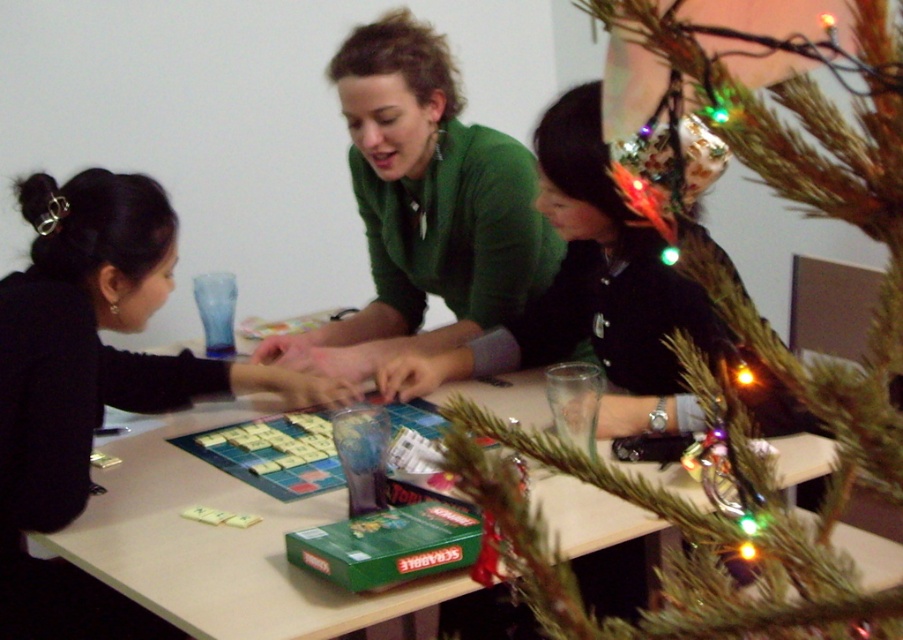
Which of these two, black matte shirt at center or matte plastic board game at center, stands taller?

With more height is black matte shirt at center.

The width and height of the screenshot is (903, 640). In order to click on black matte shirt at center in this screenshot , I will do `click(91, 385)`.

Image resolution: width=903 pixels, height=640 pixels. What are the coordinates of `black matte shirt at center` in the screenshot? It's located at (91, 385).

Can you confirm if green artificial tree at center is positioned above matte plastic board game at center?

Yes.

This screenshot has width=903, height=640. In order to click on green artificial tree at center in this screenshot , I will do `click(759, 356)`.

Who is more forward, (731,328) or (191,476)?

Point (731,328)

This screenshot has width=903, height=640. I want to click on green artificial tree at center, so click(759, 356).

Is point (26, 305) positioned in front of point (315, 336)?

Yes, it is.

Can you confirm if black matte shirt at center is bigger than green matte sweater at center?

No, black matte shirt at center is not bigger than green matte sweater at center.

Is point (126, 369) farther from camera compared to point (435, 288)?

That is False.

At what (x,y) coordinates should I click in order to perform the action: click on black matte shirt at center. Please return your answer as a coordinate pair (x, y). The height and width of the screenshot is (640, 903). Looking at the image, I should click on pyautogui.click(x=91, y=385).